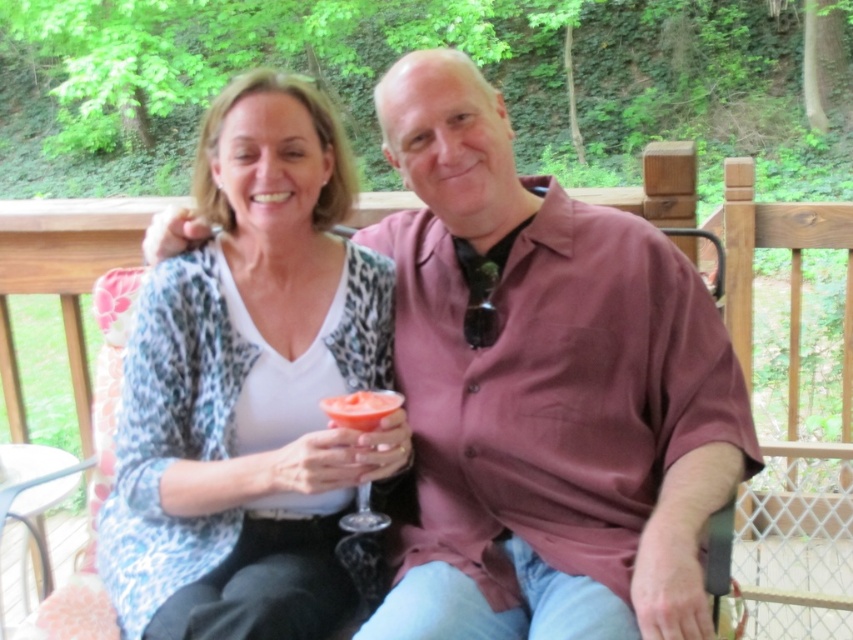
Question: Which of these objects is positioned closest to the translucent glass at center?

Choices:
 (A) white leopard print cardigan at center
 (B) pink matte shirt at center

Answer: (A)

Question: Which point is farther from the camera taking this photo?

Choices:
 (A) (474, 282)
 (B) (223, 580)
 (C) (364, 410)

Answer: (A)

Question: Which point appears farthest from the camera in this image?

Choices:
 (A) (373, 428)
 (B) (437, 257)

Answer: (B)

Question: Is white leopard print cardigan at center further to the viewer compared to translucent glass at center?

Choices:
 (A) no
 (B) yes

Answer: (A)

Question: Does white leopard print cardigan at center have a larger size compared to translucent glass at center?

Choices:
 (A) yes
 (B) no

Answer: (A)

Question: Does pink matte shirt at center appear over white leopard print cardigan at center?

Choices:
 (A) yes
 (B) no

Answer: (B)